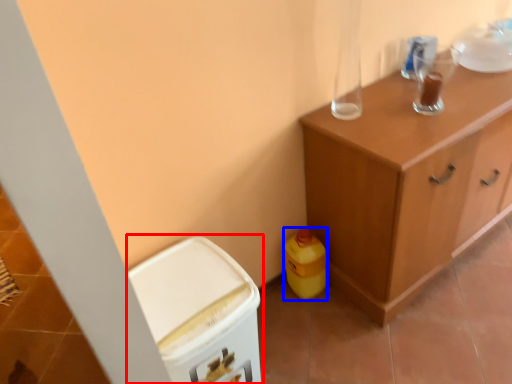
Question: Which object appears farthest to the camera in this image, cabinetry (highlighted by a red box) or cleaning product (highlighted by a blue box)?

Choices:
 (A) cabinetry
 (B) cleaning product

Answer: (B)